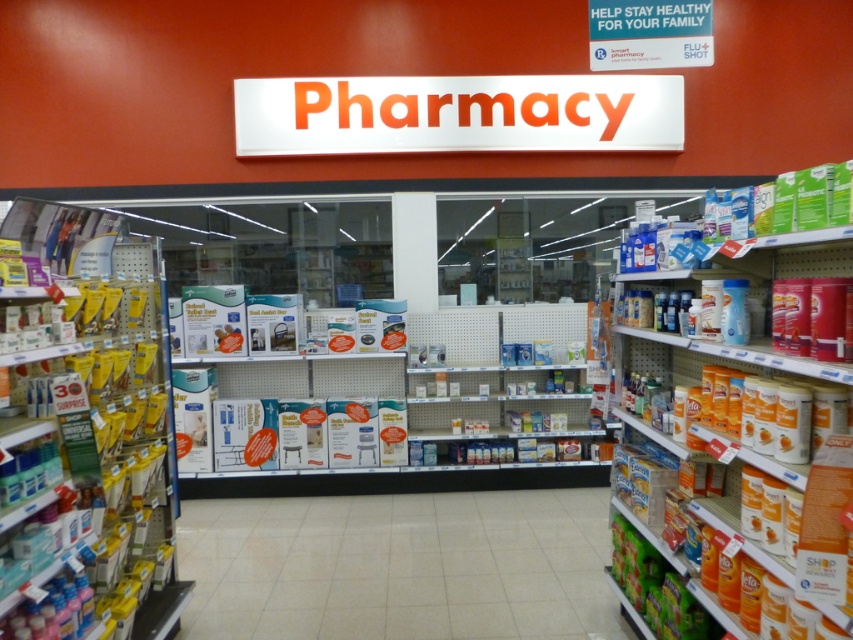
Between point (138, 413) and point (735, 588), which one is positioned behind?

The point (138, 413) is behind.

Describe the element at coordinates (86, 426) in the screenshot. The image size is (853, 640). I see `yellow plastic boxes at left` at that location.

Does point (4, 538) come behind point (805, 400)?

Yes, point (4, 538) is behind point (805, 400).

What are the coordinates of `yellow plastic boxes at left` in the screenshot? It's located at [86, 426].

Is yellow plastic boxes at left above white tile floor at center?

Yes.

Between yellow plastic boxes at left and white tile floor at center, which one is positioned lower?

white tile floor at center is below.

Is point (138, 440) positioned behind point (579, 621)?

No, (138, 440) is closer to viewer.

At what (x,y) coordinates should I click in order to perform the action: click on yellow plastic boxes at left. Please return your answer as a coordinate pair (x, y). This screenshot has height=640, width=853. Looking at the image, I should click on (86, 426).

Does white tile floor at center come behind orange cardboard boxes at right?

Yes, it is behind orange cardboard boxes at right.

Which is above, white tile floor at center or orange cardboard boxes at right?

orange cardboard boxes at right

Locate an element on the screen. This screenshot has height=640, width=853. white tile floor at center is located at coordinates (399, 566).

This screenshot has height=640, width=853. Identify the location of white tile floor at center. (399, 566).